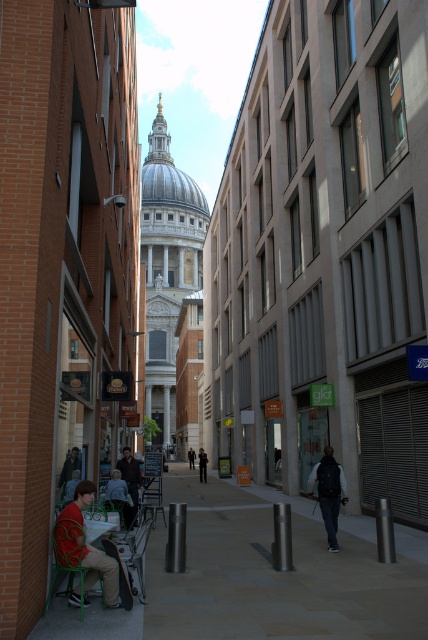
Question: Is white marble dome at center above dark gray jacket at lower left?

Choices:
 (A) no
 (B) yes

Answer: (B)

Question: Which of the following is the farthest from the observer?

Choices:
 (A) (77, 490)
 (B) (204, 451)

Answer: (B)

Question: Which of the following is the farthest from the observer?

Choices:
 (A) [x=92, y=554]
 (B) [x=162, y=120]
 (C) [x=332, y=536]

Answer: (B)

Question: Can you confirm if white marble dome at center is positioned to the right of dark brown leather jacket at lower left?

Choices:
 (A) no
 (B) yes

Answer: (A)

Question: Which point appears farthest from the camera in this image?

Choices:
 (A) (130, 465)
 (B) (317, 545)

Answer: (A)

Question: Does smooth concrete pavement at center appear on the right side of dark blue backpack at center?

Choices:
 (A) yes
 (B) no

Answer: (B)